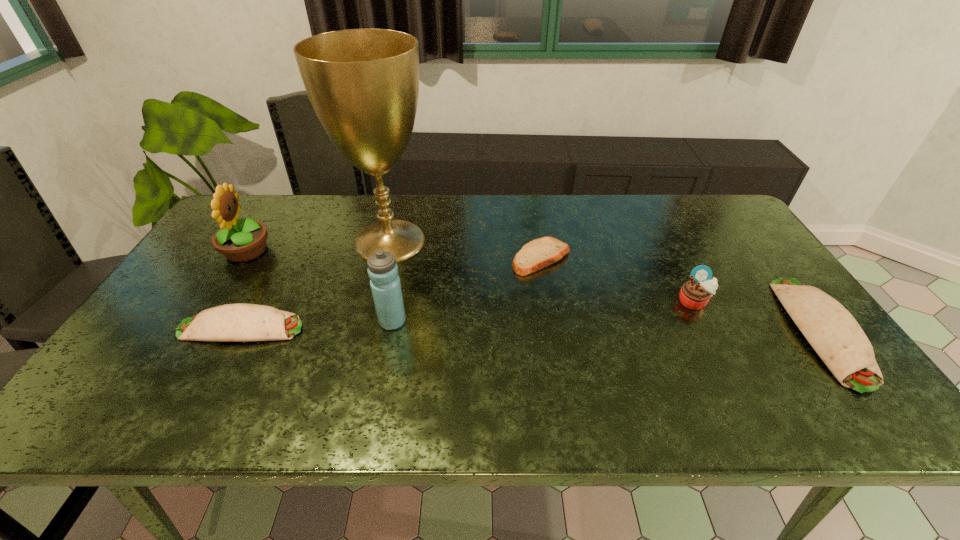
This screenshot has height=540, width=960. Find the location of `free space between the left burrito and the sunflower`. free space between the left burrito and the sunflower is located at coordinates (244, 289).

Locate an element on the screen. free spot between the shortest object and the water bottle is located at coordinates (467, 290).

Where is `free space between the sunflower and the rightmost object`? This screenshot has height=540, width=960. free space between the sunflower and the rightmost object is located at coordinates (534, 291).

Find the location of a particular element. The height and width of the screenshot is (540, 960). free point between the taller burrito and the muffin is located at coordinates coord(757,316).

At what (x,y) coordinates should I click in order to perform the action: click on vacant area that lies between the tallest object and the right burrito. Please return your answer as a coordinate pair (x, y). The image size is (960, 540). Looking at the image, I should click on (605, 286).

The height and width of the screenshot is (540, 960). I want to click on free space between the pita bread and the trophy cup, so click(x=466, y=249).

The width and height of the screenshot is (960, 540). Find the location of `vacant space that's between the water bottle and the right burrito`. vacant space that's between the water bottle and the right burrito is located at coordinates (607, 326).

Find the location of a particular element. The width and height of the screenshot is (960, 540). empty location between the tallest object and the sunflower is located at coordinates (318, 246).

Locate an element on the screen. empty space that is in between the left burrito and the tallest object is located at coordinates (316, 285).

You are a GUI agent. You are given a task and a screenshot of the screen. Output one action in this format:
    pyautogui.click(x=<x>, y=<y>)
    Task: Click on the object that is the third nearest to the pita bread
    This screenshot has width=960, height=540.
    Given the screenshot: What is the action you would take?
    pyautogui.click(x=382, y=269)